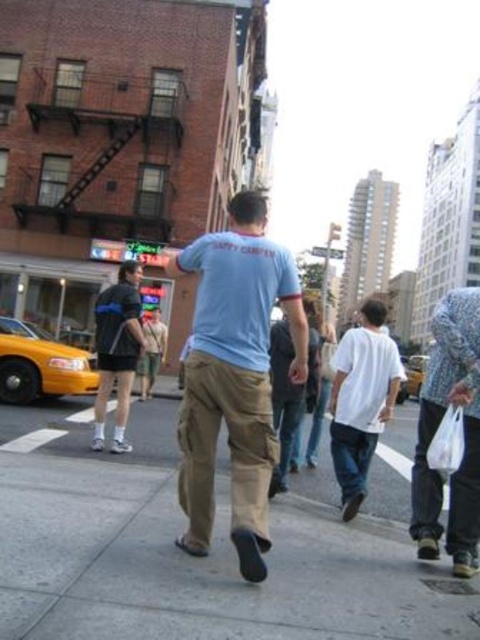
Question: Estimate the real-world distances between objects in this image. Which object is closer to the light blue cotton t-shirt at center?

Choices:
 (A) yellow matte taxi at lower left
 (B) tan fabric pants at center
 (C) light blue cotton shirt at center
 (D) khaki pants at center

Answer: (D)

Question: Can you confirm if tan fabric pants at center is wider than floral-patterned shirt at right?

Choices:
 (A) yes
 (B) no

Answer: (B)

Question: Observing the image, what is the correct spatial positioning of dark gray fabric shorts at left in reference to yellow matte taxi at lower left?

Choices:
 (A) above
 (B) below

Answer: (A)

Question: Considering the real-world distances, which object is farthest from the dark gray fabric shorts at left?

Choices:
 (A) light blue cotton shirt at center
 (B) floral-patterned shirt at right

Answer: (B)

Question: Can you confirm if light blue cotton t-shirt at center is positioned above white cotton shirt at center?

Choices:
 (A) yes
 (B) no

Answer: (B)

Question: Considering the real-world distances, which object is farthest from the light blue cotton t-shirt at center?

Choices:
 (A) khaki pants at center
 (B) tan fabric pants at center
 (C) white cotton shirt at center
 (D) floral-patterned shirt at right

Answer: (D)